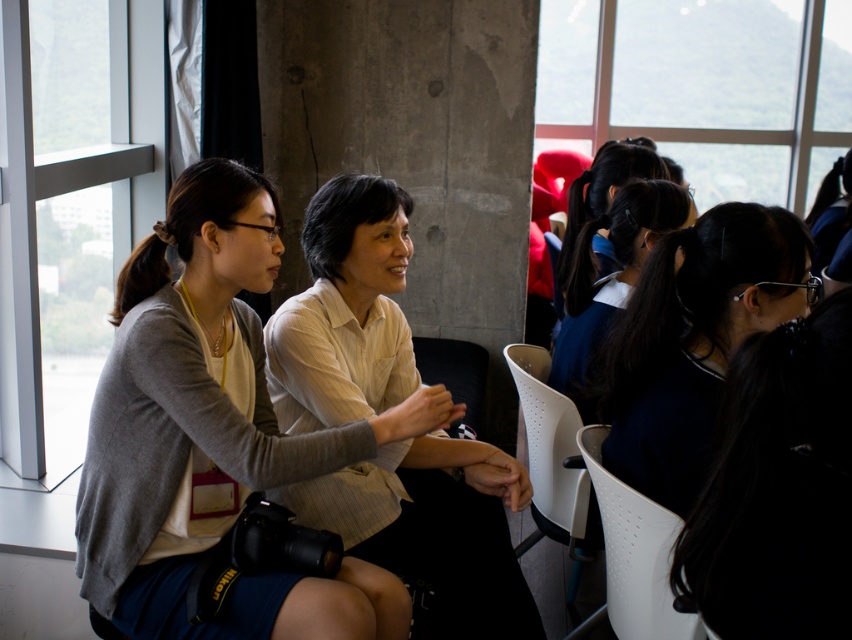
You are planning to seat two more people in the room. There are two chairs available at the center area. One is the white perforated plastic chair at center and the other is the white perforated chair at center. Which chair would be more suitable for someone who needs more seating space?

The white perforated plastic chair at center is bigger than the white perforated chair at center, so it would provide more seating space.

You are standing in the room and want to move from point A to point B. Point A is at coordinates point (x=258, y=376) and point B is at coordinates point (x=597, y=476). Which direction should you move to get from point A to point B?

To move from point A to point B, you should move towards the upper right direction since point B is located at a higher coordinate in both the x and y axes compared to point A.

You are standing at the entrance of the room and see the white perforated plastic chair at center. If you want to walk straight to it, which direction should you head towards?

Since the white perforated plastic chair at center is located at point 0.750 on the x axis and 0.644 on the y axis, you should head towards the center of the room to reach it.